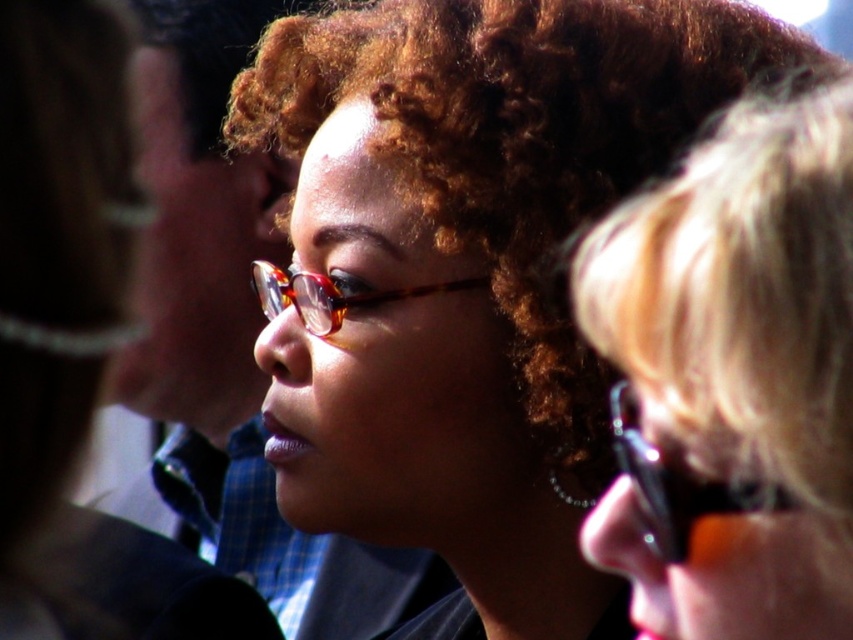
Locate an element on the screen. The width and height of the screenshot is (853, 640). matte brown hair at center is located at coordinates (469, 269).

Which is in front, point (303, 454) or point (653, 225)?

Point (653, 225)

Locate an element on the screen. matte brown hair at center is located at coordinates (469, 269).

Does transparent plastic goggles at right appear over tortoiseshell glasses at center?

No, transparent plastic goggles at right is not above tortoiseshell glasses at center.

Is point (657, 452) in front of point (254, 262)?

Yes.

Locate an element on the screen. This screenshot has height=640, width=853. transparent plastic goggles at right is located at coordinates (676, 484).

Which is behind, point (746, 272) or point (788, 500)?

The point (788, 500) is more distant.

Who is positioned more to the left, matte black glasses at upper right or transparent plastic goggles at right?

From the viewer's perspective, transparent plastic goggles at right appears more on the left side.

Which is behind, point (816, 179) or point (683, 488)?

The point (683, 488) is more distant.

This screenshot has height=640, width=853. What are the coordinates of `matte black glasses at upper right` in the screenshot? It's located at (735, 372).